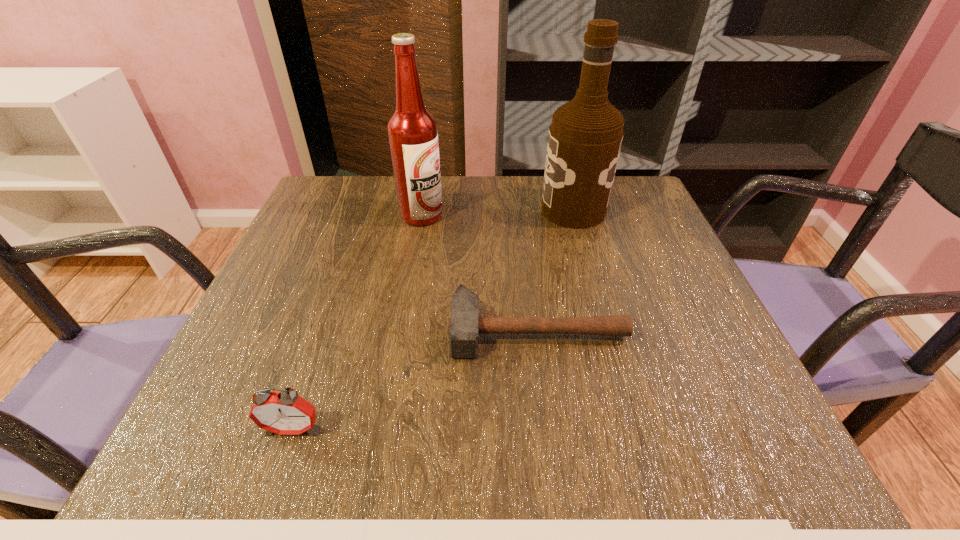
The image size is (960, 540). I want to click on free space located on the striking surface of the hammer, so click(x=549, y=426).

The width and height of the screenshot is (960, 540). I want to click on object located at the near edge, so click(x=285, y=413).

At what (x,y) coordinates should I click in order to perform the action: click on object at the left edge. Please return your answer as a coordinate pair (x, y). Image resolution: width=960 pixels, height=540 pixels. Looking at the image, I should click on (285, 413).

Image resolution: width=960 pixels, height=540 pixels. I want to click on object located in the right edge section of the desktop, so click(585, 137).

Locate an element on the screen. object that is at the near left corner is located at coordinates (285, 413).

Find the location of `object that is at the far right corner`. object that is at the far right corner is located at coordinates (585, 137).

At what (x,y) coordinates should I click in order to perform the action: click on vacant area at the far edge of the desktop. Please return your answer as a coordinate pair (x, y). The width and height of the screenshot is (960, 540). Looking at the image, I should click on (482, 210).

Where is `free spot at the near edge of the desktop`? free spot at the near edge of the desktop is located at coordinates (427, 461).

What are the coordinates of `vacant space at the left edge of the desktop` in the screenshot? It's located at (276, 375).

In the image, there is a desktop. Where is `vacant space at the right edge`? vacant space at the right edge is located at coordinates coord(608,233).